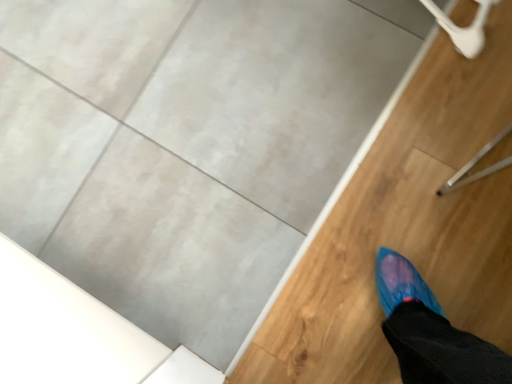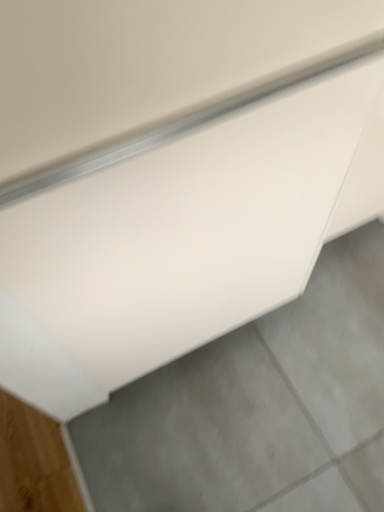
Question: How did the camera likely rotate when shooting the video?

Choices:
 (A) rotated upward
 (B) rotated downward

Answer: (A)